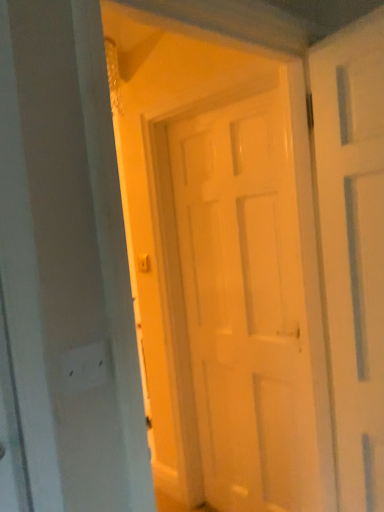
Question: Should I look upward or downward to see white matte electric outlet at lower left?

Choices:
 (A) down
 (B) up

Answer: (A)

Question: Is white matte door at center in front of white matte electric outlet at lower left?

Choices:
 (A) yes
 (B) no

Answer: (B)

Question: Does white matte door at center have a smaller size compared to white matte electric outlet at lower left?

Choices:
 (A) yes
 (B) no

Answer: (B)

Question: Considering the relative positions of white matte door at center and white matte electric outlet at lower left in the image provided, is white matte door at center behind white matte electric outlet at lower left?

Choices:
 (A) yes
 (B) no

Answer: (A)

Question: Would you consider white matte door at center to be distant from white matte electric outlet at lower left?

Choices:
 (A) yes
 (B) no

Answer: (A)

Question: Is white matte door at center positioned beyond the bounds of white matte electric outlet at lower left?

Choices:
 (A) yes
 (B) no

Answer: (A)

Question: Is white matte door at center thinner than white matte electric outlet at lower left?

Choices:
 (A) yes
 (B) no

Answer: (B)

Question: From a real-world perspective, is white matte electric outlet at lower left on white matte door at center?

Choices:
 (A) no
 (B) yes

Answer: (B)

Question: Is white matte door at center surrounded by white matte electric outlet at lower left?

Choices:
 (A) yes
 (B) no

Answer: (B)

Question: Is white matte electric outlet at lower left facing away from white matte door at center?

Choices:
 (A) yes
 (B) no

Answer: (B)

Question: Considering the relative positions of white matte electric outlet at lower left and white matte door at center in the image provided, is white matte electric outlet at lower left to the left of white matte door at center from the viewer's perspective?

Choices:
 (A) no
 (B) yes

Answer: (B)

Question: Would you consider white matte electric outlet at lower left to be distant from white matte door at center?

Choices:
 (A) no
 (B) yes

Answer: (B)

Question: Is white matte electric outlet at lower left at the right side of white matte door at center?

Choices:
 (A) no
 (B) yes

Answer: (A)

Question: From a real-world perspective, relative to white matte electric outlet at lower left, is white matte door at center vertically above or below?

Choices:
 (A) below
 (B) above

Answer: (A)